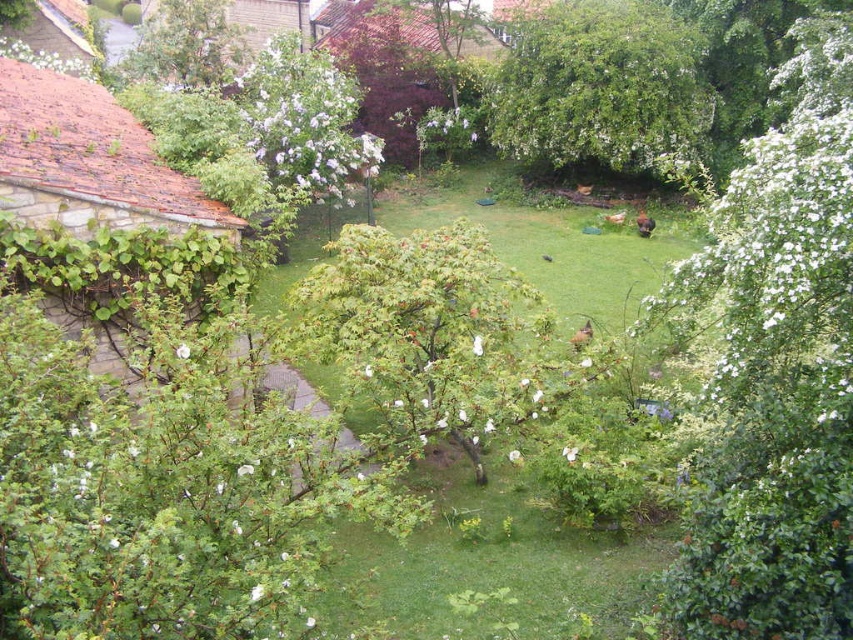
Is white fluffy bush at right taller than green grass at center?

Yes, white fluffy bush at right is taller than green grass at center.

Does point (753, 544) lie in front of point (537, 524)?

Yes.

Identify the location of white fluffy bush at right. The image size is (853, 640). (776, 372).

Who is taller, white fluffy bush at right or green leafy tree at upper left?

white fluffy bush at right is taller.

Does white fluffy bush at right come in front of green leafy tree at upper left?

Yes, it is in front of green leafy tree at upper left.

Where is `white fluffy bush at right`? The image size is (853, 640). white fluffy bush at right is located at coordinates (776, 372).

Who is more forward, (x=518, y=141) or (x=164, y=17)?

Point (x=518, y=141)

Does green leafy bush at upper center come behind green leafy tree at upper left?

No, green leafy bush at upper center is in front of green leafy tree at upper left.

Between point (592, 144) and point (200, 8), which one is positioned behind?

Positioned behind is point (200, 8).

Image resolution: width=853 pixels, height=640 pixels. Identify the location of green leafy bush at upper center. (601, 88).